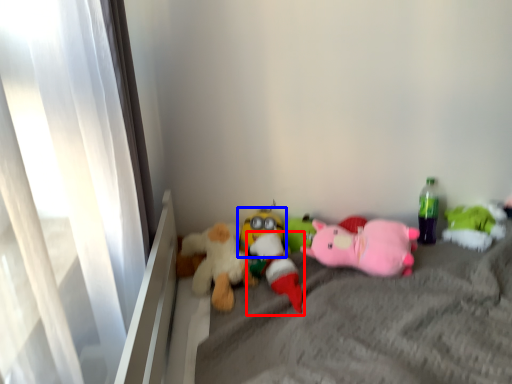
Question: Which point is further to the camera, toy (highlighted by a red box) or toy (highlighted by a blue box)?

Choices:
 (A) toy
 (B) toy

Answer: (B)